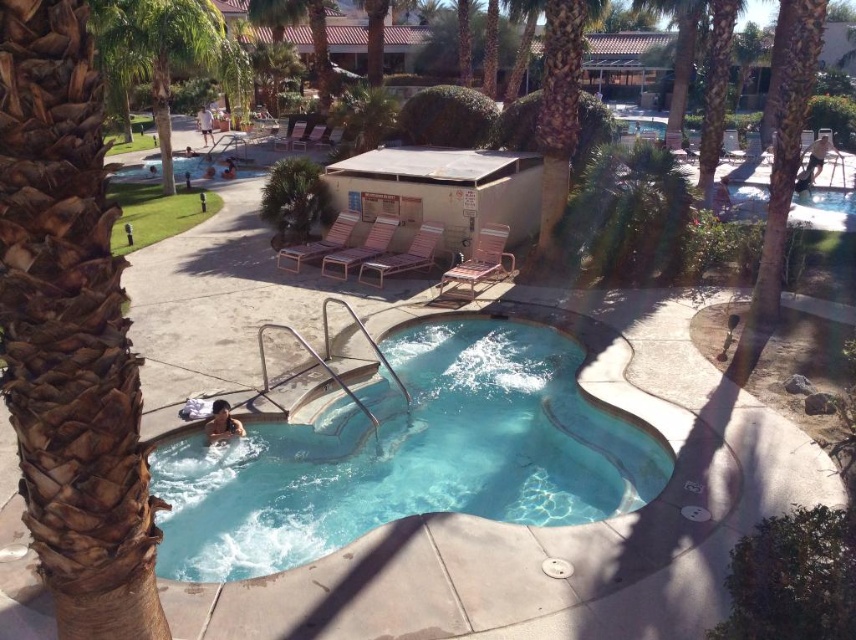
Can you confirm if brown textured palm tree at center is positioned to the right of smooth skin person at lower left?

Yes, brown textured palm tree at center is to the right of smooth skin person at lower left.

Is brown textured palm tree at center above smooth skin person at lower left?

Yes, brown textured palm tree at center is above smooth skin person at lower left.

Is point (550, 228) behind point (210, 417)?

Yes, it is.

At what (x,y) coordinates should I click in order to perform the action: click on brown textured palm tree at center. Please return your answer as a coordinate pair (x, y). Looking at the image, I should click on (559, 106).

Can you confirm if clear blue water at center is shorter than brown textured palm tree at center?

Indeed, clear blue water at center has a lesser height compared to brown textured palm tree at center.

Is clear blue water at center closer to the viewer compared to brown textured palm tree at center?

Yes, clear blue water at center is closer to the viewer.

Where is `clear blue water at center`? The height and width of the screenshot is (640, 856). clear blue water at center is located at coordinates (409, 456).

Identify the location of clear blue water at center. The width and height of the screenshot is (856, 640). (409, 456).

Between smooth skin person at lower left and tan shorts at center, which one is positioned lower?

smooth skin person at lower left

Does smooth skin person at lower left have a lesser width compared to tan shorts at center?

Indeed, smooth skin person at lower left has a lesser width compared to tan shorts at center.

This screenshot has width=856, height=640. I want to click on smooth skin person at lower left, so click(223, 422).